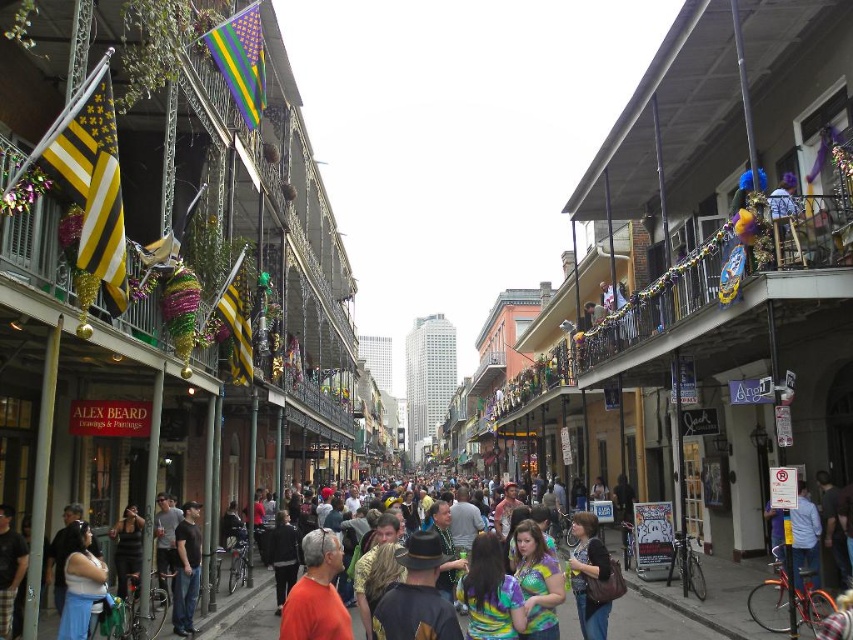
You are a photographer standing in the middle of the street. You want to take a photo of the orange tshirt at center located at point (316, 593). Which direction should you face to capture it?

The orange tshirt at center is located at point (316, 593), so you should face towards the center of the street to capture it.

You are a photographer standing on the street and want to capture a photo of the dark gray shirt at center without the multicolored fabric crowd at center in the foreground. Is this possible?

The dark gray shirt at center is located above the multicolored fabric crowd at center, so yes, you can position yourself to capture the dark gray shirt at center without the crowd blocking it by angling the camera upwards.